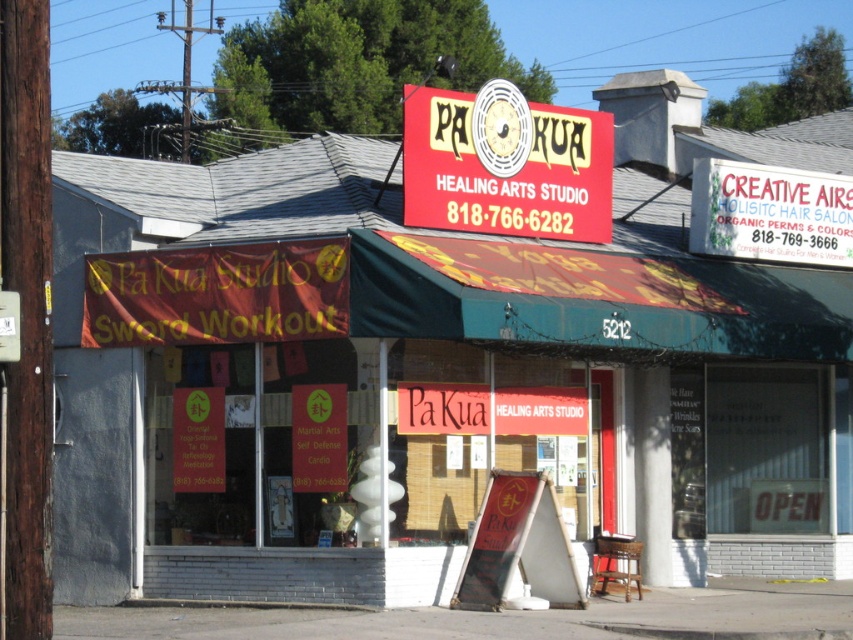
Question: Observing the image, what is the correct spatial positioning of red plastic sign at center in reference to matte red sign at center?

Choices:
 (A) above
 (B) below

Answer: (A)

Question: Can you confirm if white plastic sign at upper right is thinner than matte red sign at center?

Choices:
 (A) yes
 (B) no

Answer: (B)

Question: Is white plastic sign at upper right to the left of matte red sign at center from the viewer's perspective?

Choices:
 (A) no
 (B) yes

Answer: (A)

Question: Which object is farther from the camera taking this photo?

Choices:
 (A) red plastic sign at center
 (B) matte red sign at center
 (C) white plastic sign at upper right

Answer: (C)

Question: Which is nearer to the red plastic sign at center?

Choices:
 (A) white plastic sign at upper right
 (B) matte red sign at center

Answer: (A)

Question: Which object appears farthest from the camera in this image?

Choices:
 (A) matte red sign at center
 (B) red plastic sign at center
 (C) white plastic sign at upper right

Answer: (C)